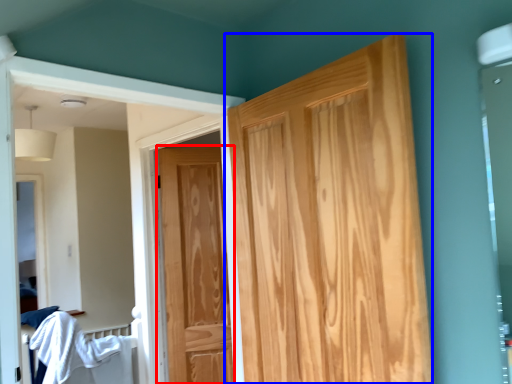
Question: Which object is closer to the camera taking this photo, door (highlighted by a red box) or door (highlighted by a blue box)?

Choices:
 (A) door
 (B) door

Answer: (B)